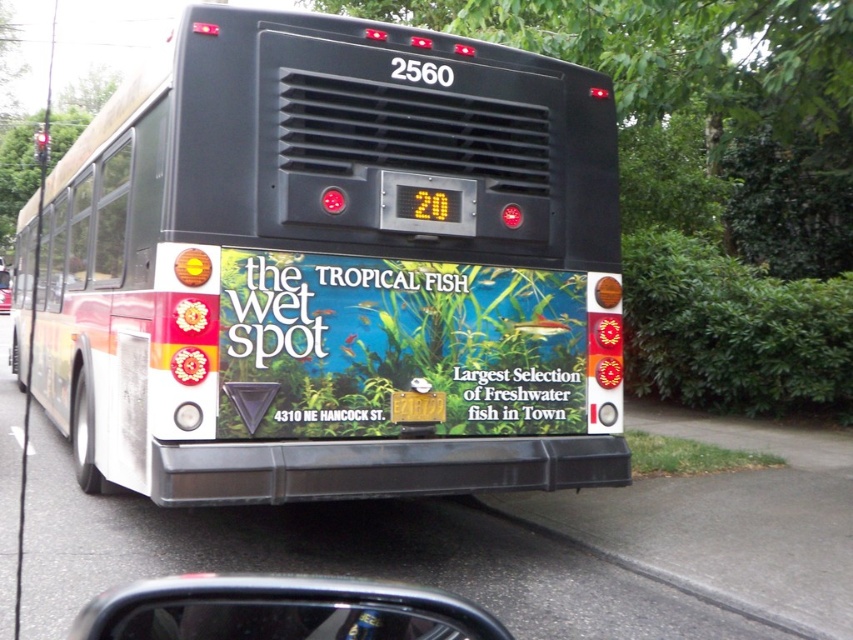
Question: Considering the real-world distances, which object is closest to the gray concrete curb at lower right?

Choices:
 (A) black matte bus at center
 (B) metallic silver car at center

Answer: (A)

Question: Is matte plastic signboard at center to the left of gray concrete curb at lower right from the viewer's perspective?

Choices:
 (A) no
 (B) yes

Answer: (B)

Question: Does matte plastic signboard at center lie in front of gray concrete curb at lower right?

Choices:
 (A) yes
 (B) no

Answer: (B)

Question: Does matte plastic signboard at center have a lesser width compared to metallic silver car at center?

Choices:
 (A) yes
 (B) no

Answer: (B)

Question: Based on their relative distances, which object is farther from the black matte bus at center?

Choices:
 (A) metallic silver car at center
 (B) gray concrete curb at lower right
 (C) matte plastic signboard at center

Answer: (A)

Question: Which point is farther to the camera?

Choices:
 (A) (42, 212)
 (B) (0, 307)
 (C) (685, 550)

Answer: (B)